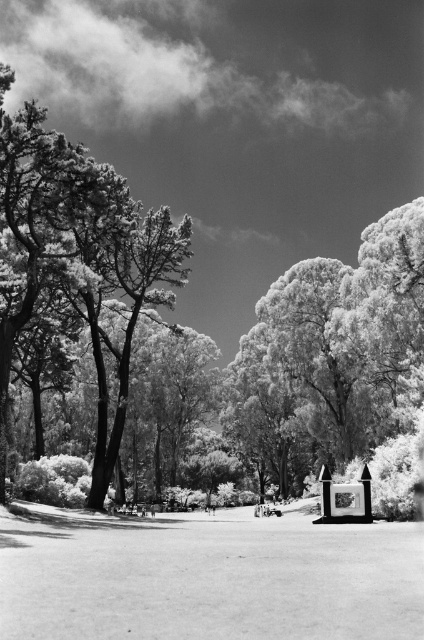
Which is above, smooth bark tree at center or smooth white tree at left?

smooth bark tree at center

Is smooth bark tree at center bigger than smooth white tree at left?

Yes.

Identify the location of smooth bark tree at center. This screenshot has height=640, width=424. (206, 336).